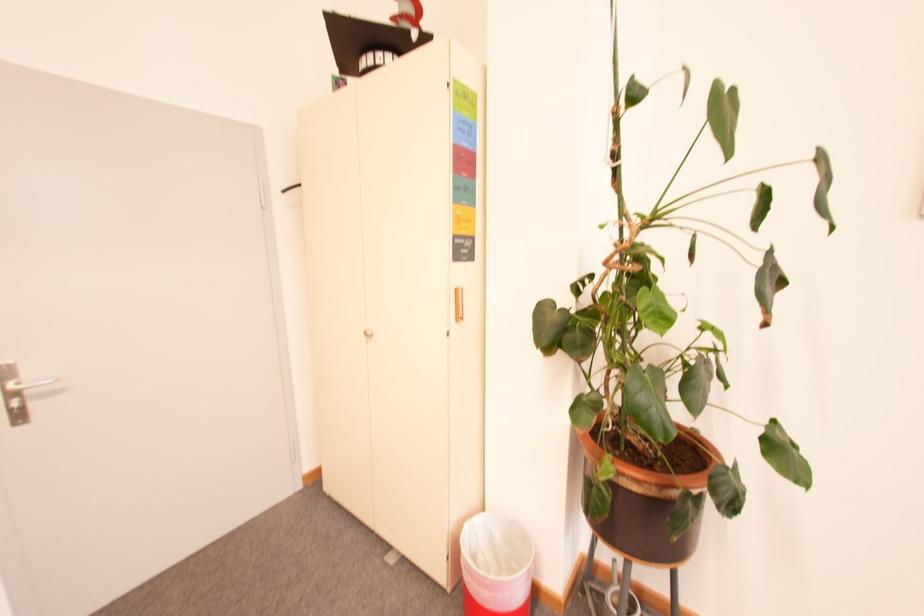
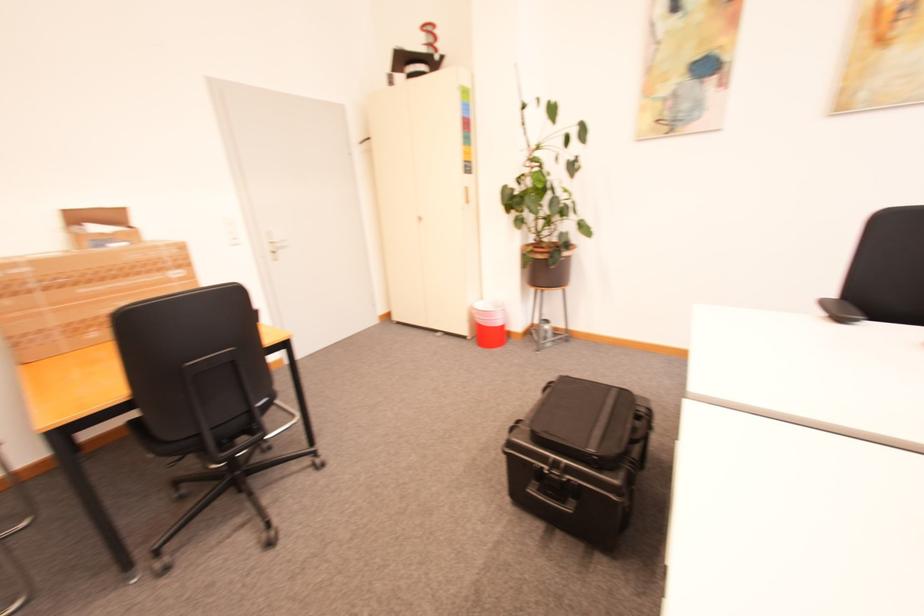
Question: What movement of the cameraman would produce the second image?

Choices:
 (A) Left
 (B) Right
 (C) Forward
 (D) Backward

Answer: (D)